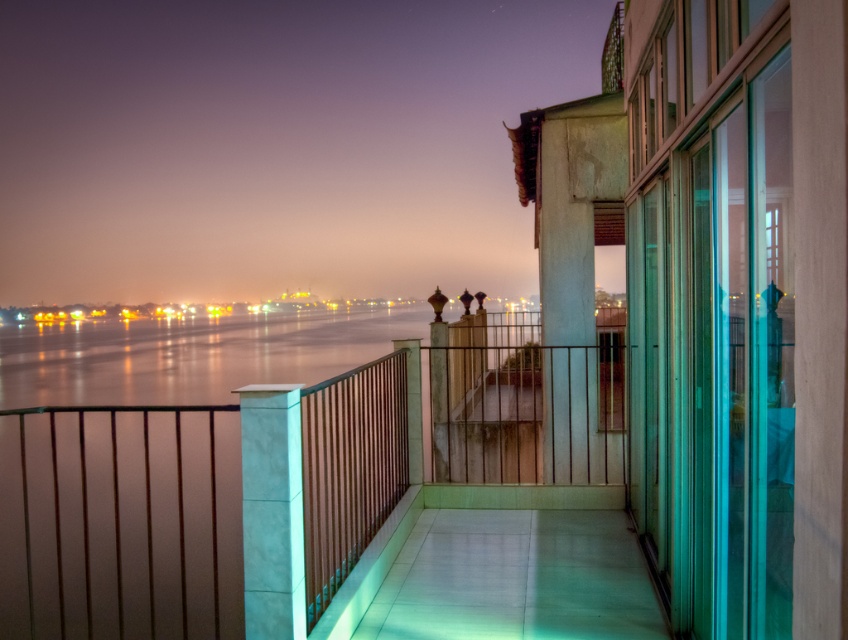
Can you confirm if glistening water at center is taller than white marble pillar at center?

Yes, glistening water at center is taller than white marble pillar at center.

Is point (455, 312) closer to camera compared to point (269, 524)?

No, it is not.

What are the coordinates of `glistening water at center` in the screenshot? It's located at (x=190, y=355).

Is metallic railing at center positioned in front of glistening water at center?

Yes.

Is metallic railing at center bigger than glistening water at center?

Correct, metallic railing at center is larger in size than glistening water at center.

Is point (143, 227) closer to viewer compared to point (106, 352)?

No, it is not.

The image size is (848, 640). Identify the location of metallic railing at center. (274, 145).

Between metallic railing at center and white marble pillar at center, which one has more height?

metallic railing at center

Can you confirm if metallic railing at center is positioned to the left of white marble pillar at center?

Yes, metallic railing at center is to the left of white marble pillar at center.

Locate an element on the screen. The image size is (848, 640). metallic railing at center is located at coordinates (274, 145).